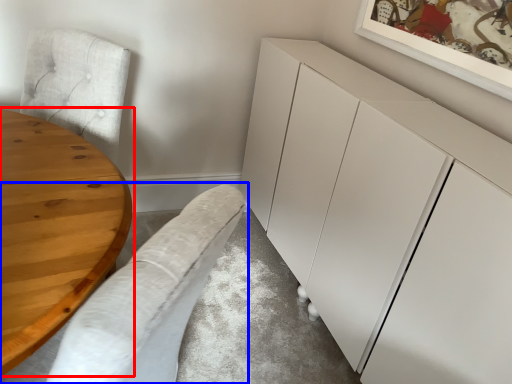
Question: Which object appears farthest to the camera in this image, table (highlighted by a red box) or couch (highlighted by a blue box)?

Choices:
 (A) table
 (B) couch

Answer: (A)